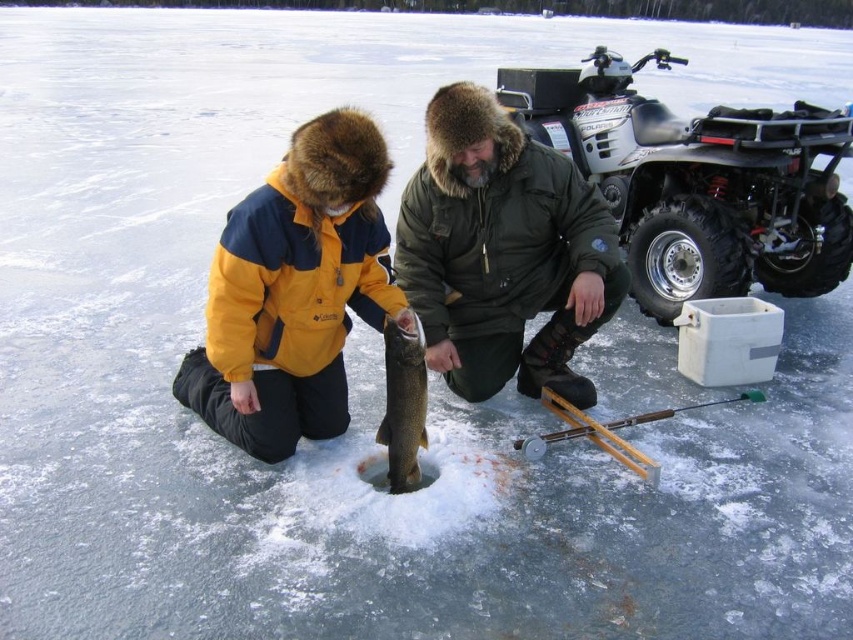
Can you confirm if white matte snowmobile at upper right is positioned below wooden fishing pole at lower center?

Actually, white matte snowmobile at upper right is above wooden fishing pole at lower center.

Which is more to the left, white matte snowmobile at upper right or wooden fishing pole at lower center?

From the viewer's perspective, wooden fishing pole at lower center appears more on the left side.

Is point (831, 172) behind point (554, 435)?

Yes, it is.

This screenshot has width=853, height=640. Find the location of `white matte snowmobile at upper right`. white matte snowmobile at upper right is located at coordinates coord(695,180).

Looking at this image, does green matte jacket at center have a greater height compared to yellow fleece jacket at center?

Indeed, green matte jacket at center has a greater height compared to yellow fleece jacket at center.

Can you confirm if green matte jacket at center is shorter than yellow fleece jacket at center?

No.

Where is `green matte jacket at center`? The width and height of the screenshot is (853, 640). green matte jacket at center is located at coordinates (503, 252).

The image size is (853, 640). I want to click on green matte jacket at center, so click(503, 252).

Does green matte jacket at center have a smaller size compared to shiny silver fish at center?

No.

Is green matte jacket at center to the left of shiny silver fish at center from the viewer's perspective?

In fact, green matte jacket at center is to the right of shiny silver fish at center.

I want to click on green matte jacket at center, so click(x=503, y=252).